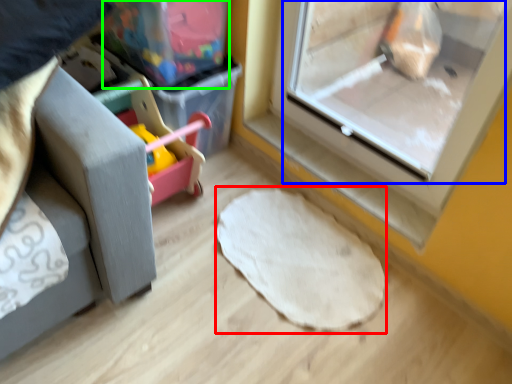
Question: Estimate the real-world distances between objects in this image. Which object is closer to mat (highlighted by a red box), screen door (highlighted by a blue box) or storage box (highlighted by a green box)?

Choices:
 (A) screen door
 (B) storage box

Answer: (B)